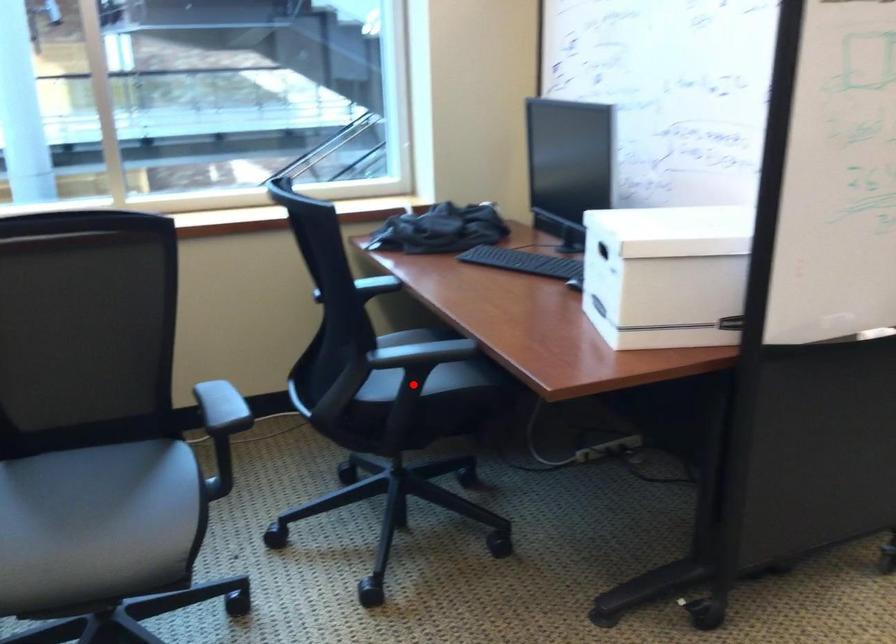
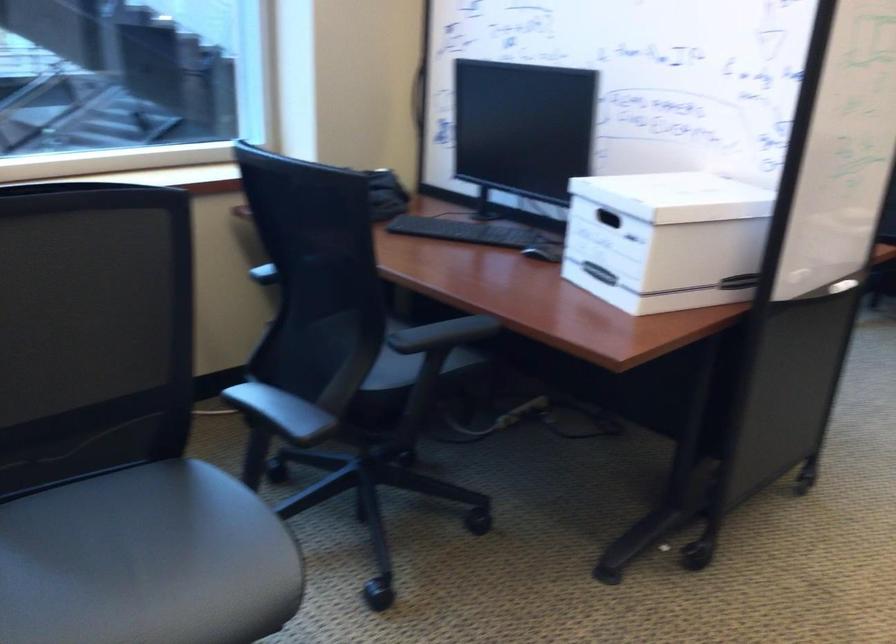
Find the pixel in the second image that matches the highlighted location in the first image.

(410, 368)